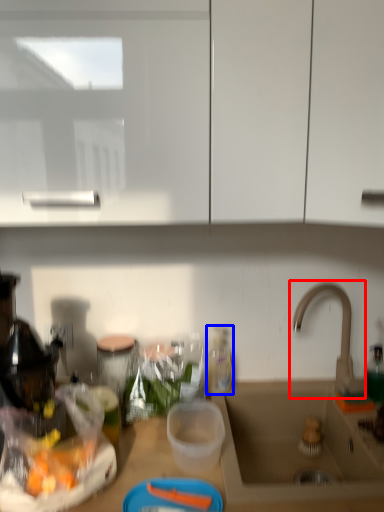
Question: Which point is further to the camera, tap (highlighted by a red box) or bottle (highlighted by a blue box)?

Choices:
 (A) tap
 (B) bottle

Answer: (B)